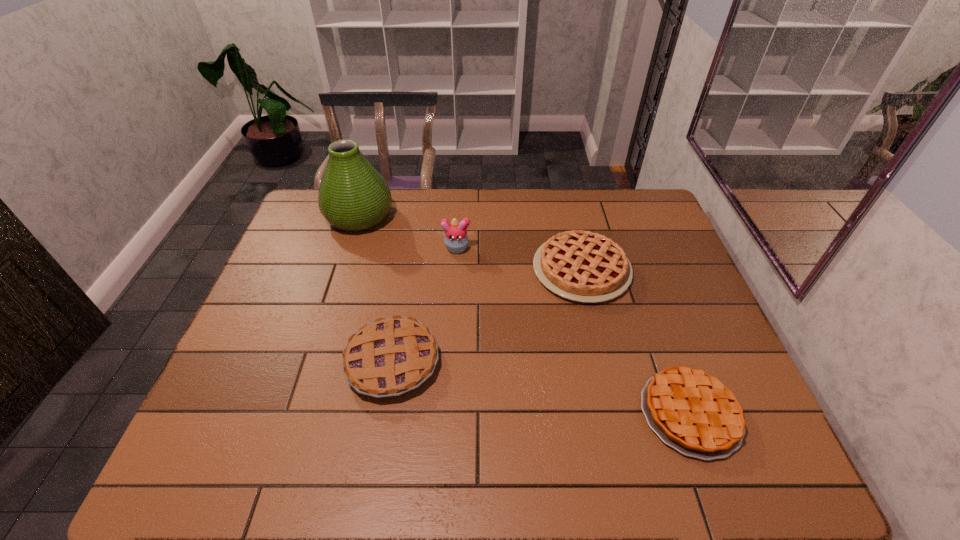
Locate which object is the second closest to the second tallest object. Please provide its 2D coordinates. Your answer should be formatted as a tuple, i.e. [(x, y)], where the tuple contains the x and y coordinates of a point satisfying the conditions above.

[(583, 266)]

Find the location of a particular element. The image size is (960, 540). object that can be found as the third closest to the cupcake is located at coordinates (391, 356).

Find the location of `pie identified as the closest to the shortest object`. pie identified as the closest to the shortest object is located at coordinates (583, 266).

The width and height of the screenshot is (960, 540). Identify the location of the second closest pie to the cupcake. (391, 356).

Where is `free space that satisfies the following two spatial constraints: 1. on the front side of the farthest pie; 2. on the right side of the vase`? The width and height of the screenshot is (960, 540). free space that satisfies the following two spatial constraints: 1. on the front side of the farthest pie; 2. on the right side of the vase is located at coordinates (343, 269).

This screenshot has width=960, height=540. I want to click on free space that satisfies the following two spatial constraints: 1. on the face of the cupcake; 2. on the right side of the farthest pie, so click(455, 269).

Locate an element on the screen. The image size is (960, 540). free spot that satisfies the following two spatial constraints: 1. on the face of the shortest object; 2. on the left side of the cupcake is located at coordinates (447, 413).

Locate an element on the screen. This screenshot has height=540, width=960. vacant region that satisfies the following two spatial constraints: 1. on the front side of the tallest object; 2. on the right side of the leftmost pie is located at coordinates (313, 362).

Where is `vacant region that satisfies the following two spatial constraints: 1. on the face of the second tallest object; 2. on the left side of the shortest object`? vacant region that satisfies the following two spatial constraints: 1. on the face of the second tallest object; 2. on the left side of the shortest object is located at coordinates (447, 413).

Locate an element on the screen. The width and height of the screenshot is (960, 540). vacant region that satisfies the following two spatial constraints: 1. on the face of the farthest pie; 2. on the left side of the fourth shortest object is located at coordinates (455, 269).